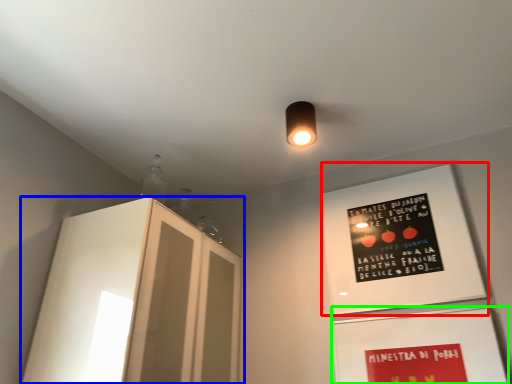
Question: Which object is the farthest from bulletin board (highlighted by a red box)? Choose among these: cabinetry (highlighted by a blue box) or bulletin board (highlighted by a green box).

Choices:
 (A) cabinetry
 (B) bulletin board

Answer: (A)